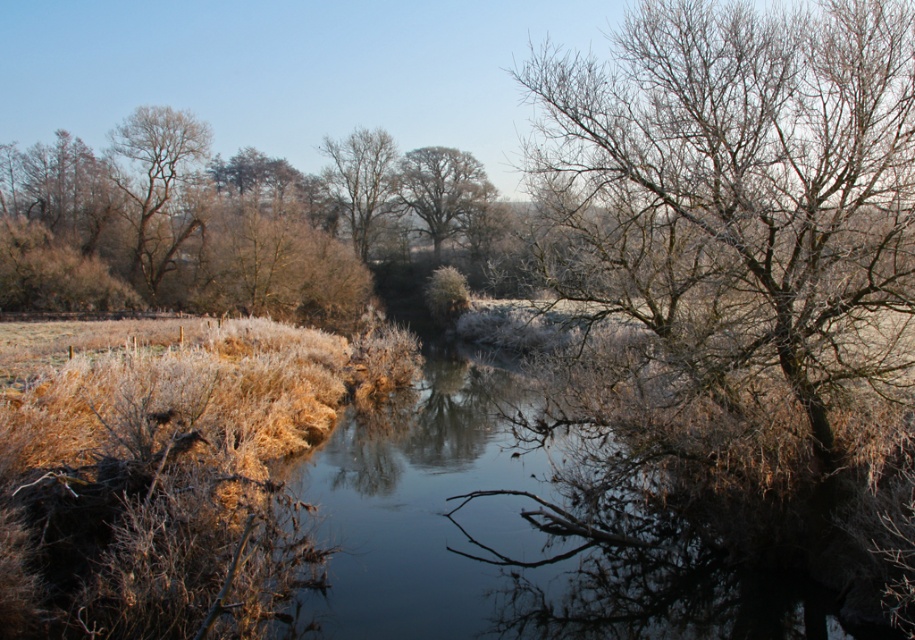
Which is more to the right, bare branches at left or smooth bark tree at center?

Positioned to the right is smooth bark tree at center.

Does bare branches at left have a larger size compared to smooth bark tree at center?

Correct, bare branches at left is larger in size than smooth bark tree at center.

What do you see at coordinates (158, 186) in the screenshot? Image resolution: width=915 pixels, height=640 pixels. I see `bare branches at left` at bounding box center [158, 186].

Where is `bare branches at left`? Image resolution: width=915 pixels, height=640 pixels. bare branches at left is located at coordinates (158, 186).

Is bare wood tree at center behind smooth bark tree at center?

No, it is not.

Can you confirm if bare wood tree at center is positioned to the left of smooth bark tree at center?

Correct, you'll find bare wood tree at center to the left of smooth bark tree at center.

You are a GUI agent. You are given a task and a screenshot of the screen. Output one action in this format:
    pyautogui.click(x=<x>, y=<y>)
    Task: Click on the bare wood tree at center
    This screenshot has width=915, height=640.
    Given the screenshot: What is the action you would take?
    pyautogui.click(x=362, y=180)

At what (x,y) coordinates should I click in order to perform the action: click on bare wood tree at center. Please return your answer as a coordinate pair (x, y). The image size is (915, 640). Looking at the image, I should click on (362, 180).

Is frosted branches at upper right to the left of smooth bark tree at center from the viewer's perspective?

No, frosted branches at upper right is not to the left of smooth bark tree at center.

Between point (817, 205) and point (436, 205), which one is positioned behind?

The point (436, 205) is behind.

Find the location of `frosted branches at upper right`. frosted branches at upper right is located at coordinates (767, 164).